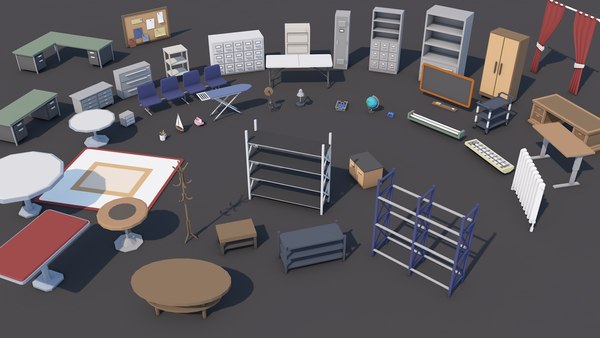
This screenshot has width=600, height=338. Identify the location of tables. (173, 287), (121, 213), (53, 235), (39, 179), (88, 121), (301, 60).